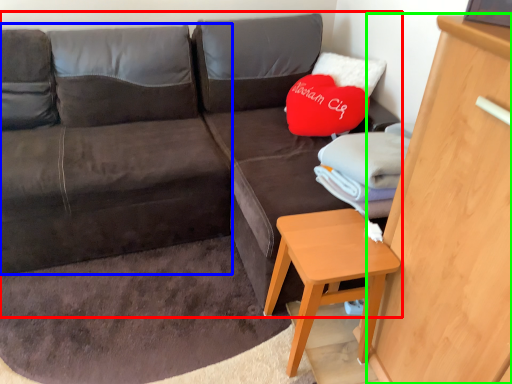
Question: Which is farther away from studio couch (highlighted by a red box)? bean bag chair (highlighted by a blue box) or dresser (highlighted by a green box)?

Choices:
 (A) bean bag chair
 (B) dresser

Answer: (B)